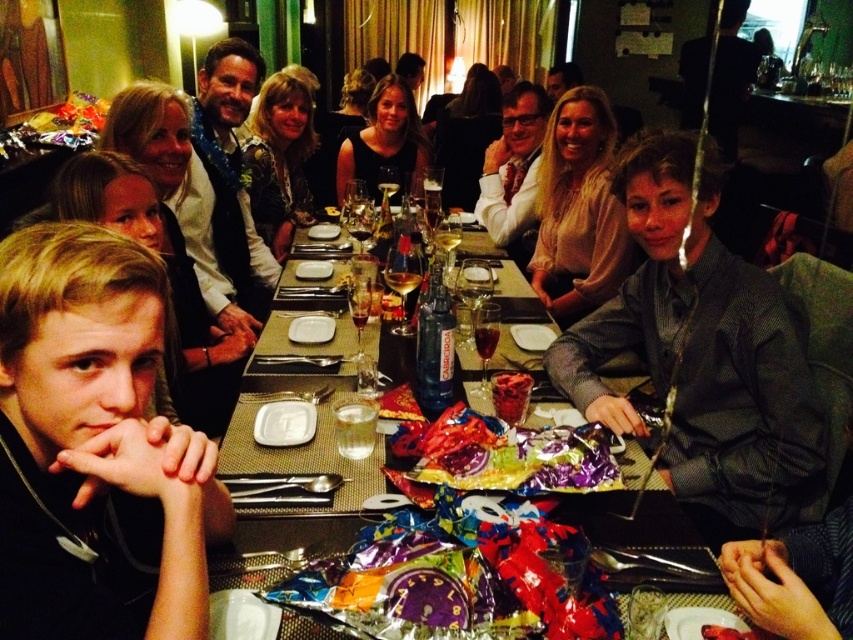
You are a server at the restaurant and need to place a new drink order on the table. The drink must be placed on the white plastic plate at center to avoid spills. However, there is an object already occupying space on the plate. Can you determine if the black matte shirt at left can be moved to make space for the drink?

The black matte shirt at left is larger in size than the white plastic plate at center, so it cannot be placed on the plate. Therefore, the shirt must be moved to another location to make space for the drink.

You are a guest at this event and want to place a small gift between the shiny foil wrapped candy at center and the matte black dress at center. Where should you place it to be exactly in the middle between them?

Place the gift between the shiny foil wrapped candy at center and the matte black dress at center, aligning it exactly in the middle between the two objects since the candy is on the right side of the dress.